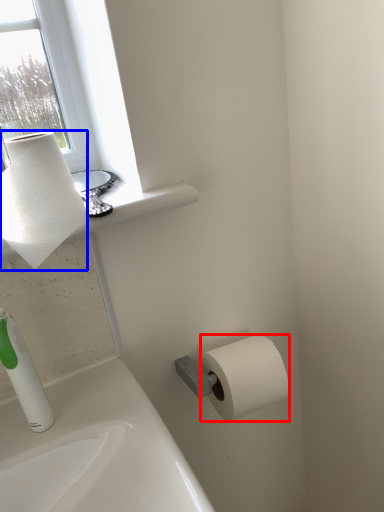
Question: Among these objects, which one is nearest to the camera, toilet paper (highlighted by a red box) or paper towel (highlighted by a blue box)?

Choices:
 (A) toilet paper
 (B) paper towel

Answer: (B)